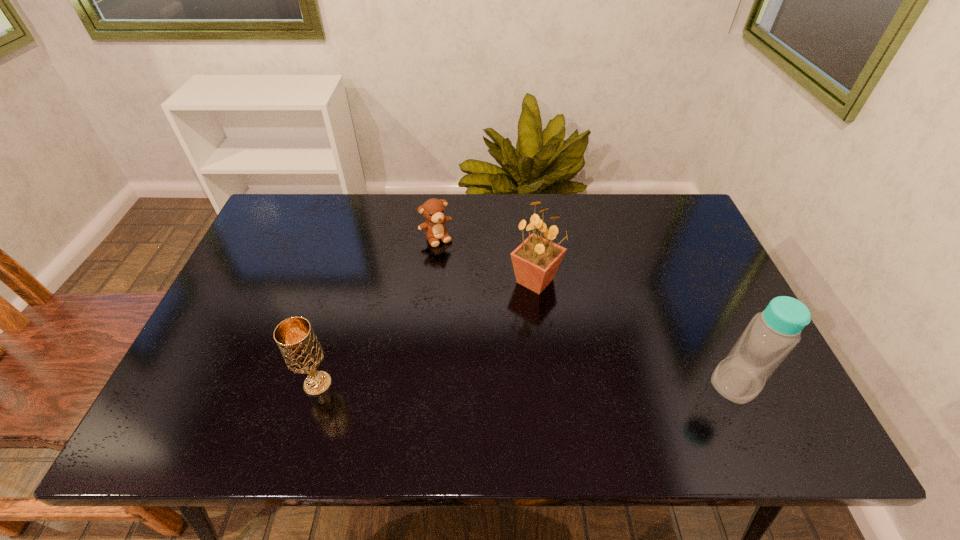
This screenshot has width=960, height=540. Identify the location of blank area located at the front of the sunflower with flowers visible. (556, 350).

Where is `vacant point located at the front of the sunflower with flowers visible`? The width and height of the screenshot is (960, 540). vacant point located at the front of the sunflower with flowers visible is located at coordinates (551, 334).

The width and height of the screenshot is (960, 540). Identify the location of free spot located on the face of the farthest object. click(x=488, y=316).

Find the location of a particular element. Image resolution: width=960 pixels, height=540 pixels. vacant space located on the face of the farthest object is located at coordinates (448, 257).

Find the location of a particular element. vacant space situated on the face of the farthest object is located at coordinates (465, 281).

Find the location of a particular element. object at the far edge is located at coordinates (433, 210).

Where is `chalice that is at the near edge`? The image size is (960, 540). chalice that is at the near edge is located at coordinates [295, 338].

This screenshot has height=540, width=960. Identify the location of bottle situated at the near edge. (771, 335).

At what (x,y) coordinates should I click in order to perform the action: click on object that is at the right edge. Please return your answer as a coordinate pair (x, y). The width and height of the screenshot is (960, 540). Looking at the image, I should click on (771, 335).

You are a GUI agent. You are given a task and a screenshot of the screen. Output one action in this format:
    pyautogui.click(x=<x>, y=<y>)
    Task: Click on the object located at the near right corner
    
    Given the screenshot: What is the action you would take?
    pyautogui.click(x=771, y=335)